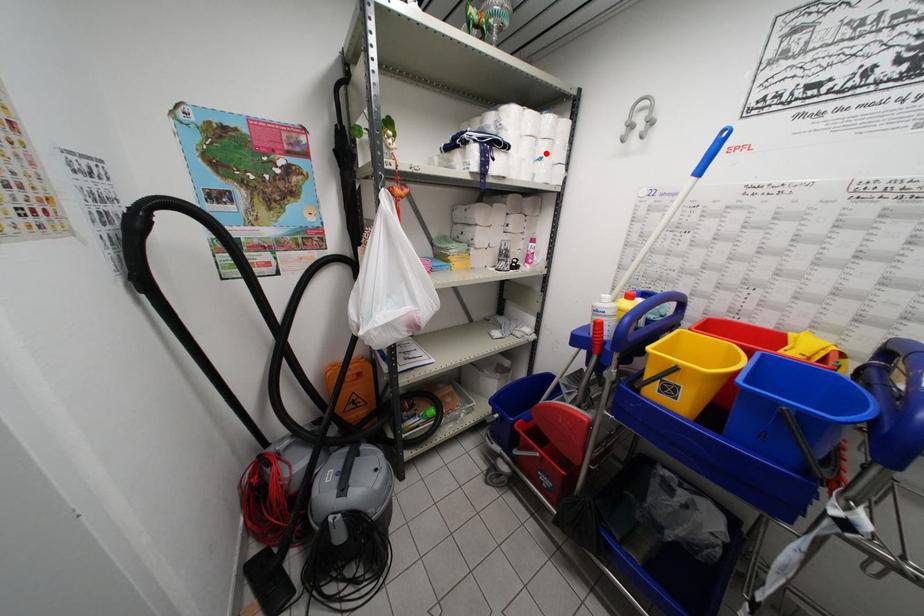
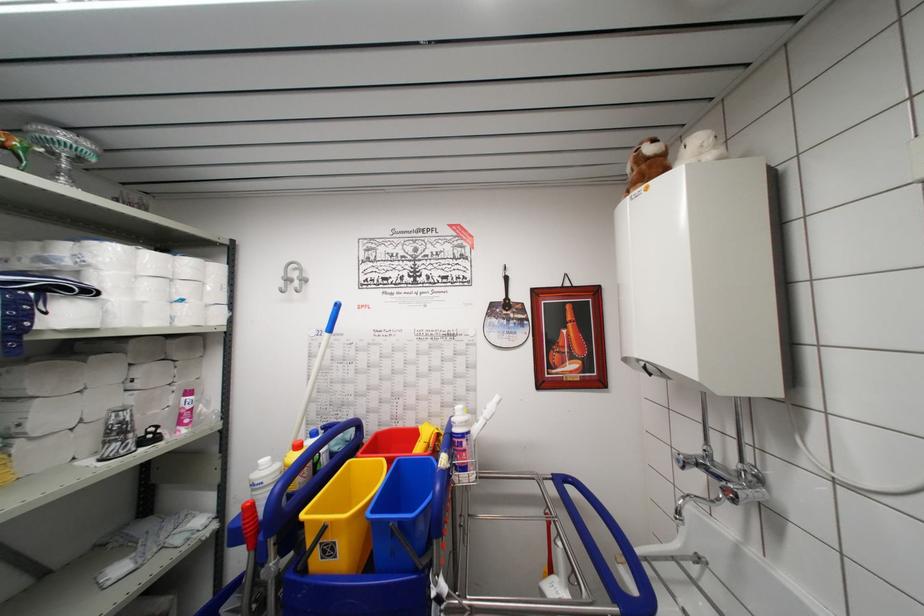
Locate, in the second image, the point that corresponds to the highlighted location in the first image.

(188, 294)